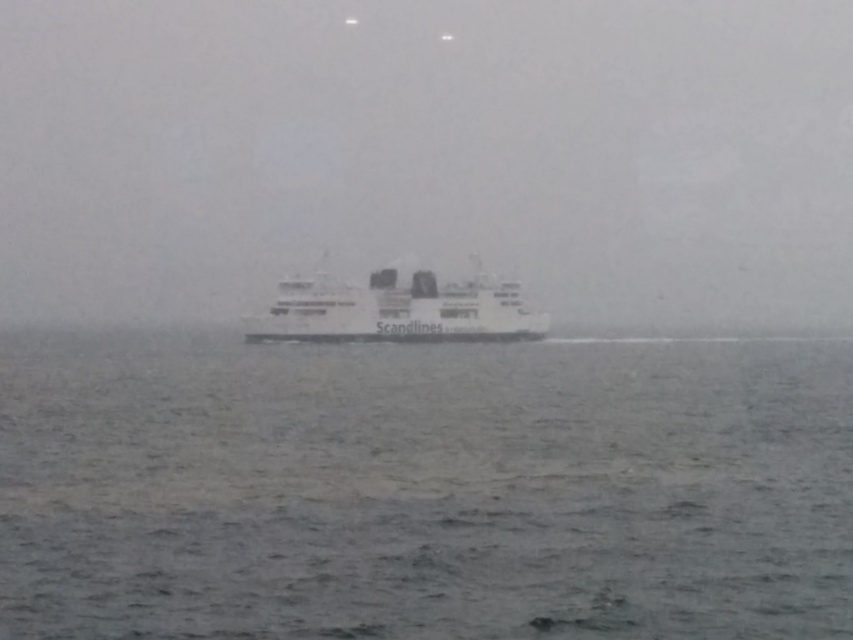
You are standing on the deck of the Scandlines ferry and looking around. There is a point at coordinates (428, 154). What is located at this point?

The point at coordinates (428, 154) corresponds to white matte fog at center.

You are a drone operator trying to land a drone on the deck of the Scandlines ferry. The drone has a maximum landing distance of 50 meters. Based on the image provided, can the drone safely land on the deck at point [694,419]?

The point [694,419] is 49.13 meters from the camera. Since the drone has a maximum landing distance of 50 meters, it can safely land at that point as it is within the safe range.